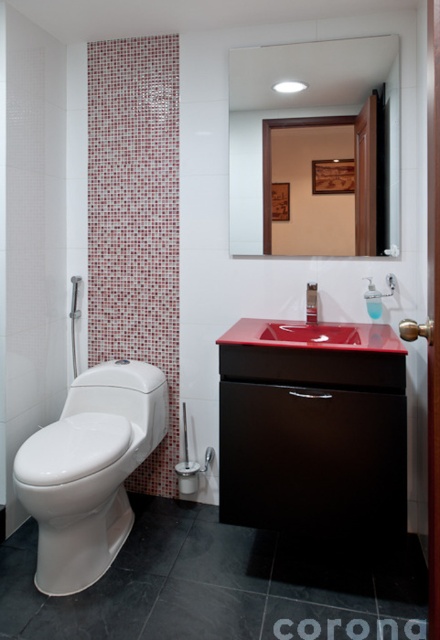
Between point (54, 436) and point (348, 333), which one is positioned behind?

Point (348, 333)

Who is more forward, (x=66, y=420) or (x=352, y=324)?

Point (x=66, y=420)

Locate an element on the screen. The height and width of the screenshot is (640, 440). white glossy toilet at left is located at coordinates (90, 470).

Looking at this image, can you confirm if white glossy toilet at left is positioned below clear glass mirror at upper center?

Indeed, white glossy toilet at left is positioned under clear glass mirror at upper center.

Does white glossy toilet at left lie in front of clear glass mirror at upper center?

Yes.

Is point (150, 442) behind point (321, 65)?

Yes, it is.

The width and height of the screenshot is (440, 640). In order to click on white glossy toilet at left in this screenshot , I will do `click(90, 470)`.

Is red glossy sink at center shorter than matte black faucet at sink right?

No, red glossy sink at center is not shorter than matte black faucet at sink right.

Between red glossy sink at center and matte black faucet at sink right, which one is positioned higher?

matte black faucet at sink right is above.

Does point (311, 426) lie in front of point (307, 289)?

Yes, point (311, 426) is in front of point (307, 289).

Find the location of `red glossy sink at center`. red glossy sink at center is located at coordinates (312, 429).